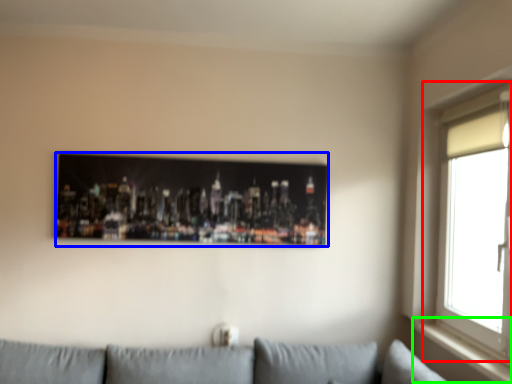
Question: Based on their relative distances, which object is nearer to window (highlighted by a red box)? Choose from picture frame (highlighted by a blue box) and window sill (highlighted by a green box).

Choices:
 (A) picture frame
 (B) window sill

Answer: (B)